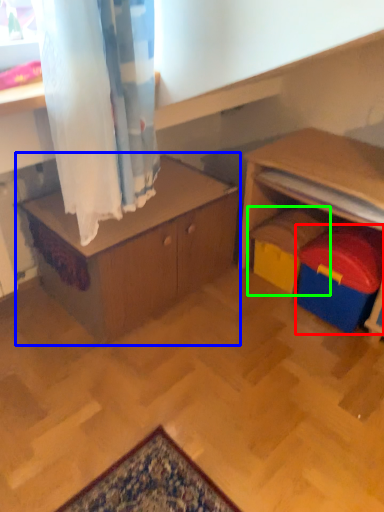
Question: Which object is the farthest from toy (highlighted by a red box)? Choose among these: table (highlighted by a blue box) or toy (highlighted by a green box).

Choices:
 (A) table
 (B) toy

Answer: (A)